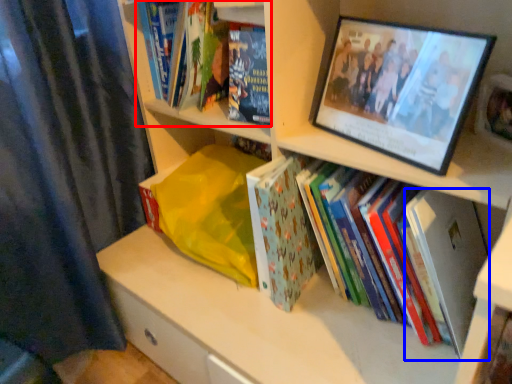
Question: Which object appears closest to the camera in this image, book (highlighted by a red box) or paperback book (highlighted by a blue box)?

Choices:
 (A) book
 (B) paperback book

Answer: (B)